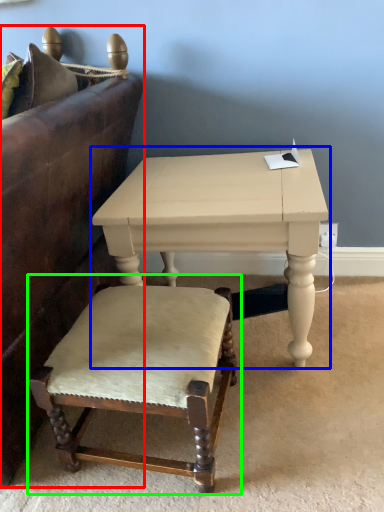
Question: Which object is the closest to the studio couch (highlighted by a red box)? Choose among these: table (highlighted by a blue box) or chair (highlighted by a green box).

Choices:
 (A) table
 (B) chair

Answer: (A)